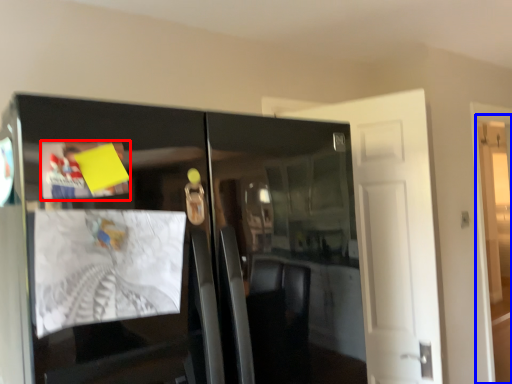
Question: Which point is further to the camera, magazine (highlighted by a red box) or door (highlighted by a blue box)?

Choices:
 (A) magazine
 (B) door

Answer: (B)